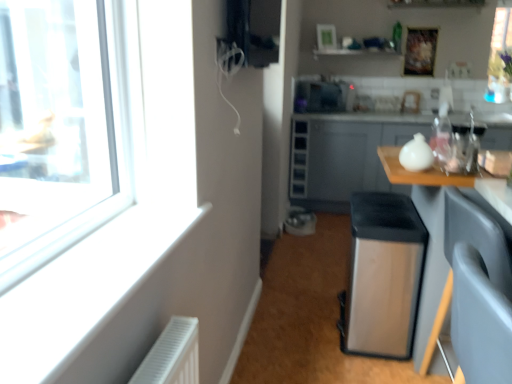
Question: From a real-world perspective, is wooden table at right physically located above or below transparent plastic bottle at upper right?

Choices:
 (A) above
 (B) below

Answer: (B)

Question: Does point (396, 155) appear closer or farther from the camera than point (438, 117)?

Choices:
 (A) closer
 (B) farther

Answer: (A)

Question: Estimate the real-world distances between objects in this image. Which object is closer to the transparent plastic bottle at upper right?

Choices:
 (A) metallic gray drawer at center, which appears as the 1th drawer when viewed from the top
 (B) satin silver water heater at center
 (C) metallic gray drawer at center, placed as the 2th drawer when sorted from top to bottom
 (D) satin black microwave at upper center
 (E) satin silver trash can at center

Answer: (B)

Question: Considering the real-world distances, which object is closest to the satin silver trash can at center?

Choices:
 (A) wooden table at right
 (B) metallic gray drawer at center, placed as the 1th drawer when sorted from bottom to top
 (C) transparent plastic bottle at upper right
 (D) satin black microwave at upper center
 (E) satin silver water heater at center

Answer: (E)